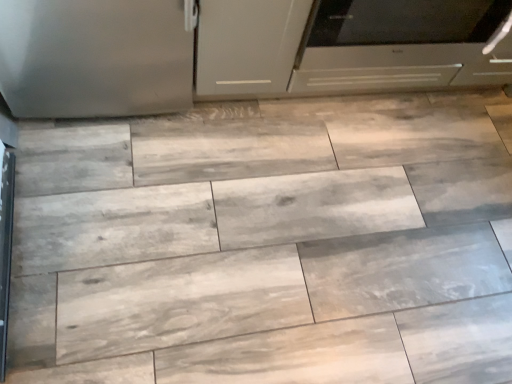
Locate an element on the screen. The width and height of the screenshot is (512, 384). matte white cabinet at center is located at coordinates (247, 46).

This screenshot has height=384, width=512. What do you see at coordinates (247, 46) in the screenshot?
I see `matte white cabinet at center` at bounding box center [247, 46].

The height and width of the screenshot is (384, 512). What do you see at coordinates (399, 45) in the screenshot? I see `satin silver oven at center` at bounding box center [399, 45].

In order to face satin silver oven at center, should I rotate leftwards or rightwards?

To align with it, rotate right about 15.042°.

Where is `satin silver oven at center`? satin silver oven at center is located at coordinates (399, 45).

Locate an element on the screen. matte white cabinet at center is located at coordinates (247, 46).

Is satin silver oven at center to the left or to the right of matte white cabinet at center in the image?

satin silver oven at center is positioned on matte white cabinet at center's right side.

Which object is more forward, satin silver oven at center or matte white cabinet at center?

matte white cabinet at center is closer to the camera.

Which point is more forward, (330, 68) or (250, 53)?

The point (250, 53) is in front.

From the image's perspective, is satin silver oven at center over matte white cabinet at center?

Yes, from the image's perspective, satin silver oven at center is over matte white cabinet at center.

From a real-world perspective, is satin silver oven at center physically located above or below matte white cabinet at center?

From a real-world perspective, satin silver oven at center is physically above matte white cabinet at center.

Does satin silver oven at center have a lesser width compared to matte white cabinet at center?

In fact, satin silver oven at center might be wider than matte white cabinet at center.

Who is taller, satin silver oven at center or matte white cabinet at center?

satin silver oven at center.

Based on their sizes in the image, would you say satin silver oven at center is bigger or smaller than matte white cabinet at center?

Considering their sizes, satin silver oven at center takes up more space than matte white cabinet at center.

Is matte white cabinet at center located within satin silver oven at center?

No, matte white cabinet at center is not a part of satin silver oven at center.

Is satin silver oven at center far away from matte white cabinet at center?

Actually, satin silver oven at center and matte white cabinet at center are a little close together.

Is satin silver oven at center positioned with its back to matte white cabinet at center?

No, matte white cabinet at center is not at the back of satin silver oven at center.

Where is `oven that appears behind the matte white cabinet at center`? oven that appears behind the matte white cabinet at center is located at coordinates (399, 45).

Considering the relative positions of matte white cabinet at center and satin silver oven at center in the image provided, is matte white cabinet at center to the right of satin silver oven at center from the viewer's perspective?

In fact, matte white cabinet at center is to the left of satin silver oven at center.

Which object is closer to the camera, matte white cabinet at center or satin silver oven at center?

Positioned in front is matte white cabinet at center.

Which point is more distant from viewer, (200, 81) or (383, 45)?

Point (200, 81)

From the image's perspective, relative to satin silver oven at center, is matte white cabinet at center above or below?

matte white cabinet at center is situated lower than satin silver oven at center in the image.

From a real-world perspective, between matte white cabinet at center and satin silver oven at center, who is vertically higher?

satin silver oven at center.

Does matte white cabinet at center have a lesser width compared to satin silver oven at center?

Yes, matte white cabinet at center is thinner than satin silver oven at center.

Between matte white cabinet at center and satin silver oven at center, which one has more height?

satin silver oven at center is taller.

Who is smaller, matte white cabinet at center or satin silver oven at center?

With smaller size is matte white cabinet at center.

Which is correct: matte white cabinet at center is inside satin silver oven at center, or outside of it?

matte white cabinet at center cannot be found inside satin silver oven at center.

Are matte white cabinet at center and satin silver oven at center making contact?

matte white cabinet at center and satin silver oven at center are clearly separated.

Is matte white cabinet at center facing towards satin silver oven at center?

No, matte white cabinet at center is not aimed at satin silver oven at center.

How different are the orientations of matte white cabinet at center and satin silver oven at center in degrees?

The angular difference between matte white cabinet at center and satin silver oven at center is 0.648 degrees.

In order to click on oven above the matte white cabinet at center (from a real-world perspective) in this screenshot , I will do `click(399, 45)`.

You are a GUI agent. You are given a task and a screenshot of the screen. Output one action in this format:
    pyautogui.click(x=<x>, y=<y>)
    Task: Click on the cabinetry on the left of satin silver oven at center
    This screenshot has width=512, height=384.
    Given the screenshot: What is the action you would take?
    pyautogui.click(x=247, y=46)

Locate an element on the screen. cabinetry below the satin silver oven at center (from a real-world perspective) is located at coordinates (247, 46).